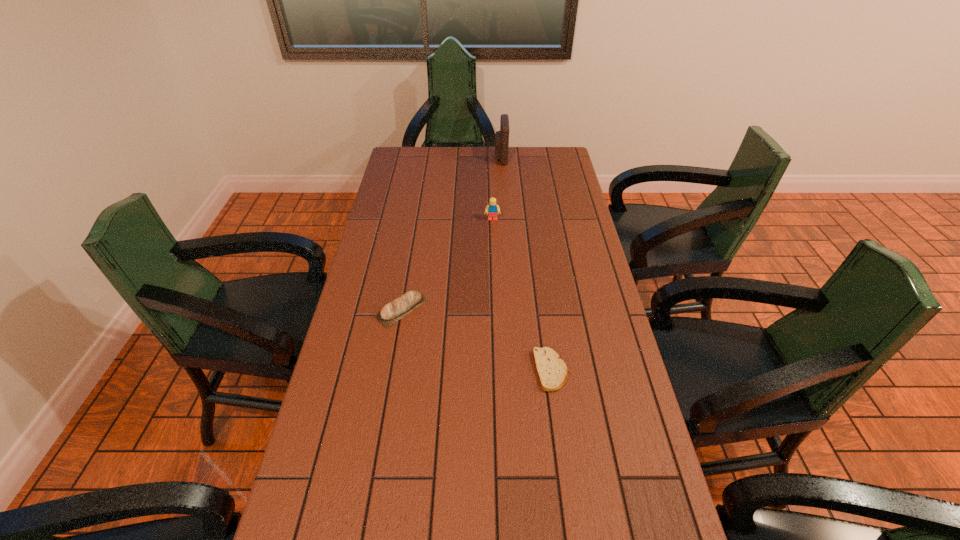
Where is `vacant region between the shortest object and the tallest object`? Image resolution: width=960 pixels, height=540 pixels. vacant region between the shortest object and the tallest object is located at coordinates (526, 264).

Find the location of a particular element. object that is the third closest one to the second nearest object is located at coordinates (501, 137).

What are the coordinates of `the third closest object to the right pita bread` in the screenshot? It's located at (501, 137).

Locate an element on the screen. The width and height of the screenshot is (960, 540). vacant space that satisfies the following two spatial constraints: 1. on the front side of the right pita bread; 2. on the right side of the left pita bread is located at coordinates (391, 370).

The image size is (960, 540). What are the coordinates of `free space that satisfies the following two spatial constraints: 1. with an open flap on the right pita bread; 2. on the right side of the tallest object` in the screenshot? It's located at (516, 370).

Where is `vacant space that satisfies the following two spatial constraints: 1. with an open flap on the shorter pita bread; 2. on the right side of the tallest object`? vacant space that satisfies the following two spatial constraints: 1. with an open flap on the shorter pita bread; 2. on the right side of the tallest object is located at coordinates (516, 370).

I want to click on vacant area in the image that satisfies the following two spatial constraints: 1. with an open flap on the tallest object; 2. on the front-facing side of the Lego, so click(505, 220).

Identify the location of vacant area in the image that satisfies the following two spatial constraints: 1. with an open flap on the tallest object; 2. on the right side of the shortest object. This screenshot has width=960, height=540. (516, 370).

Find the location of a particular element. free space that satisfies the following two spatial constraints: 1. with an open flap on the pouch; 2. on the front-facing side of the third nearest object is located at coordinates (505, 220).